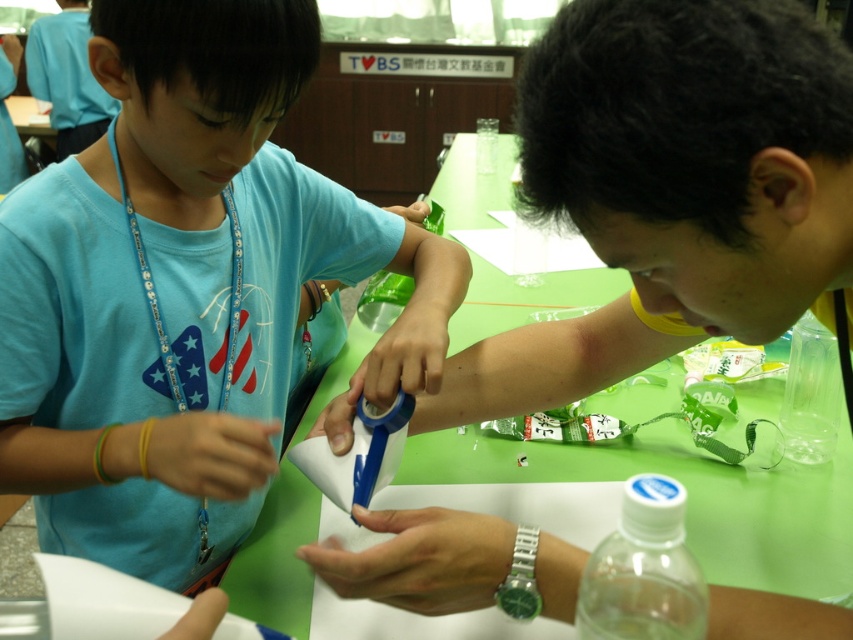
Who is higher up, green plastic table at center or clear plastic bottle at center?

green plastic table at center is higher up.

Locate an element on the screen. This screenshot has height=640, width=853. green plastic table at center is located at coordinates (689, 502).

Based on the photo, between matte blue t-shirt at left and green plastic table at center, which one appears on the left side from the viewer's perspective?

matte blue t-shirt at left

Locate an element on the screen. Image resolution: width=853 pixels, height=640 pixels. matte blue t-shirt at left is located at coordinates (184, 291).

This screenshot has width=853, height=640. In order to click on matte blue t-shirt at left in this screenshot , I will do `click(184, 291)`.

Where is `green plastic table at center`? The height and width of the screenshot is (640, 853). green plastic table at center is located at coordinates (689, 502).

Which is behind, point (851, 451) or point (802, 342)?

Positioned behind is point (851, 451).

Locate an element on the screen. The image size is (853, 640). green plastic table at center is located at coordinates (689, 502).